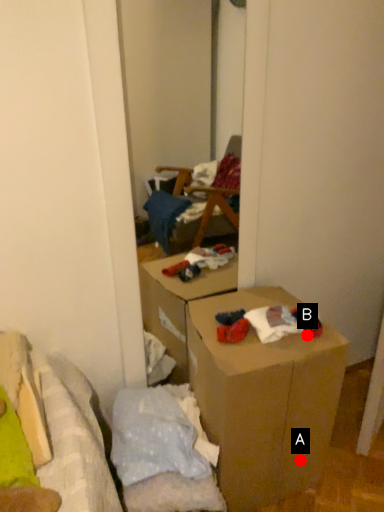
Question: Two points are circled on the image, labeled by A and B beside each circle. Which point is closer to the camera?

Choices:
 (A) A is closer
 (B) B is closer

Answer: (B)